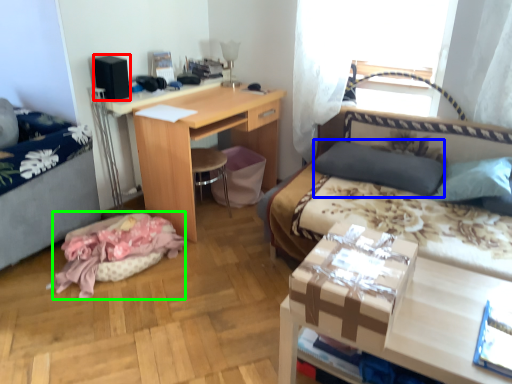
Question: Estimate the real-world distances between objects in this image. Which object is farther from box (highlighted by a red box), pillow (highlighted by a blue box) or material (highlighted by a green box)?

Choices:
 (A) pillow
 (B) material

Answer: (A)